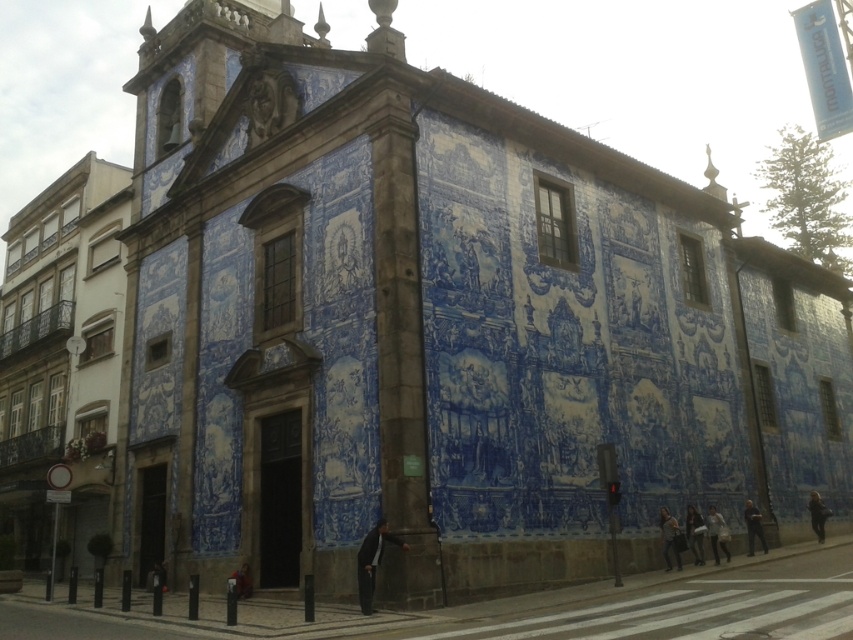
You are a pedestrian standing on the sidewalk in front of the building. You see a light brown leather jacket at lower right and a dark blue fabric jacket at center. Which jacket is positioned more to the right?

The light brown leather jacket at lower right is positioned more to the right than the dark blue fabric jacket at center.